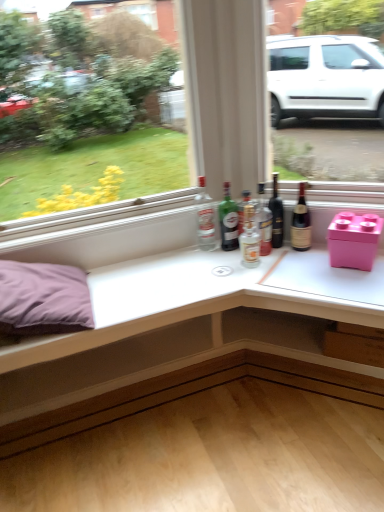
In order to click on free space to the left of translucent glass bottle at center, placed as the third bottle when sorted from right to left in this screenshot , I will do `click(207, 255)`.